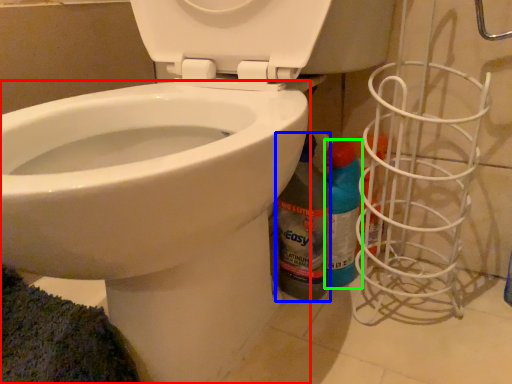
Question: Estimate the real-world distances between objects in this image. Which object is closer to bidet (highlighted by a red box), cleaning product (highlighted by a blue box) or cleaning product (highlighted by a green box)?

Choices:
 (A) cleaning product
 (B) cleaning product

Answer: (A)